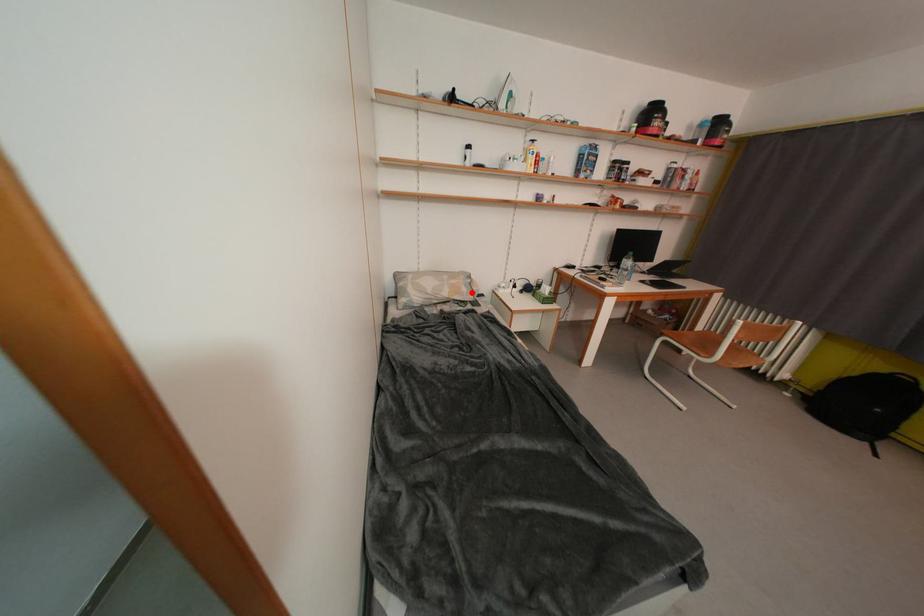
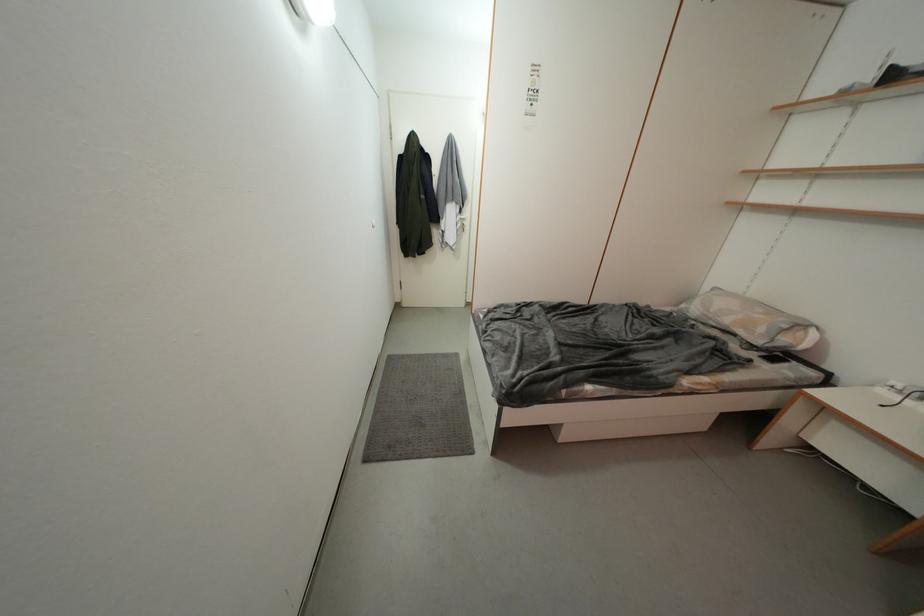
Where in the second image is the point corresponding to the highlighted location from the first image?

(769, 333)